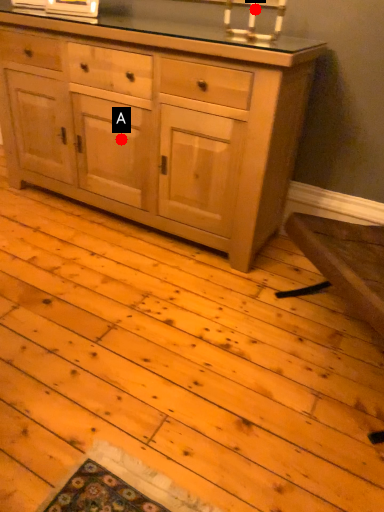
Question: Two points are circled on the image, labeled by A and B beside each circle. Among these points, which one is farthest from the camera?

Choices:
 (A) A is further
 (B) B is further

Answer: (A)